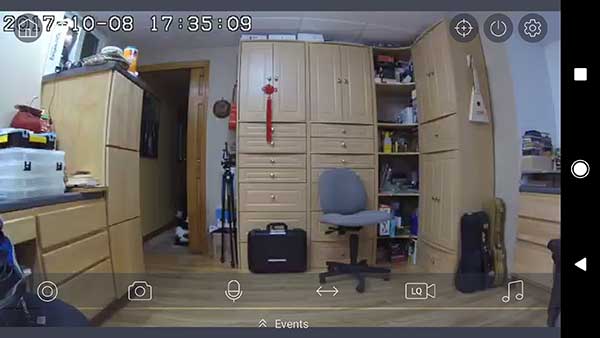
Where is `white wall`? This screenshot has height=338, width=600. white wall is located at coordinates (542, 65), (226, 59).